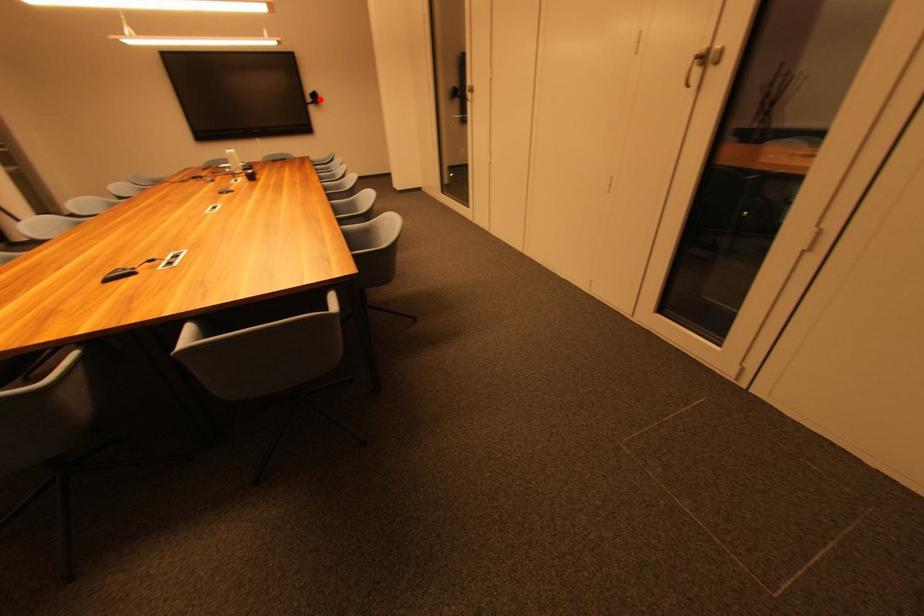
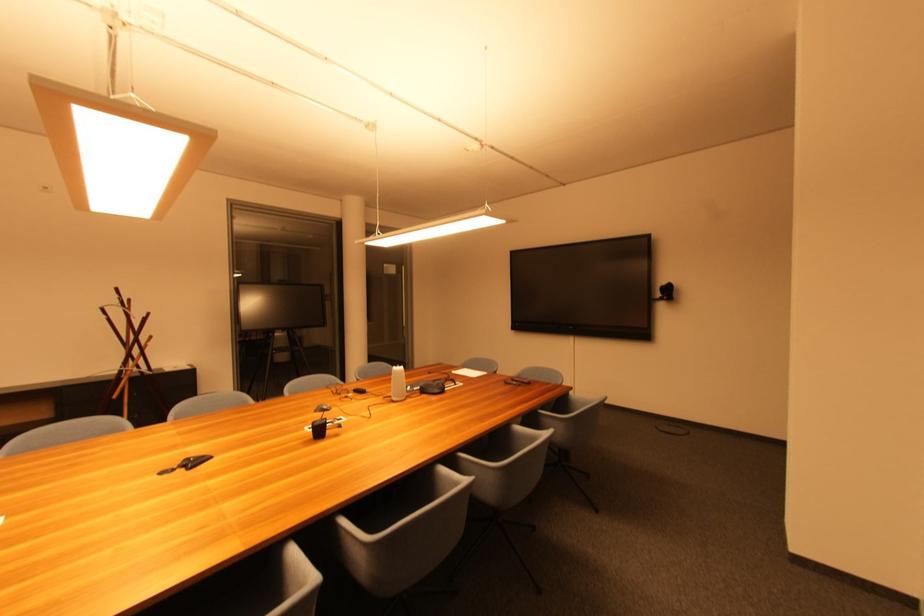
Locate, in the second image, the point that corresponds to the highlighted location in the first image.

(673, 292)